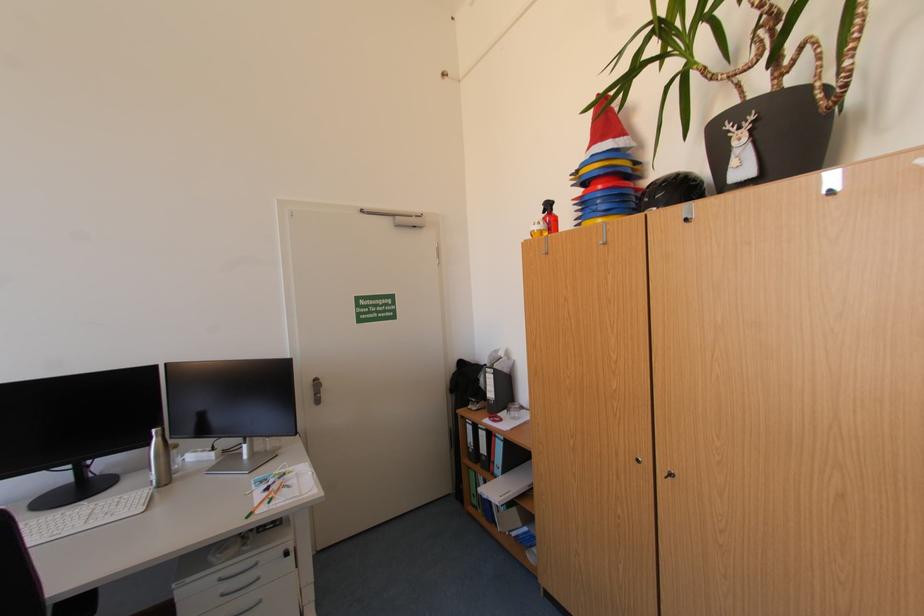
The location [159,459] corresponds to which object?

This point indicates the stainless steel bottle.